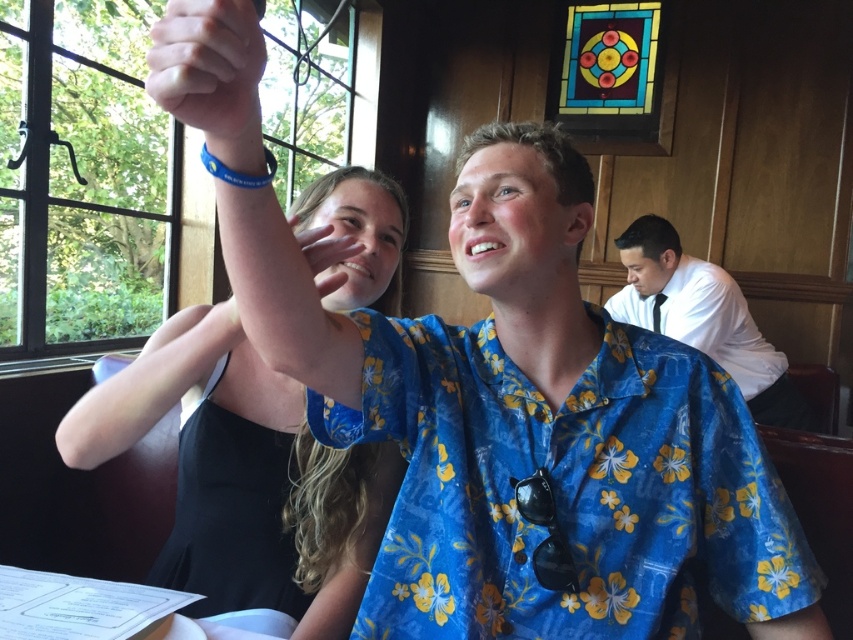
You are a photographer trying to capture the scene from the left side of the room. You need to position yourself so that the black matte dress at upper left and the matte skin hand at upper center are both visible in the frame. Based on their positions, which object should be closer to the left edge of your photo?

The black matte dress at upper left should be closer to the left edge of the photo since it is positioned to the left of the matte skin hand at upper center.

You are a photographer trying to capture a photo of both the black matte dress at upper left and the white shirt at right. Since the camera can only focus on one subject at a time, which one should you focus on first to ensure it appears in the foreground?

The white shirt at right should be focused on first because the black matte dress at upper left is below it, meaning the white shirt at right is closer to the camera and thus in the foreground.